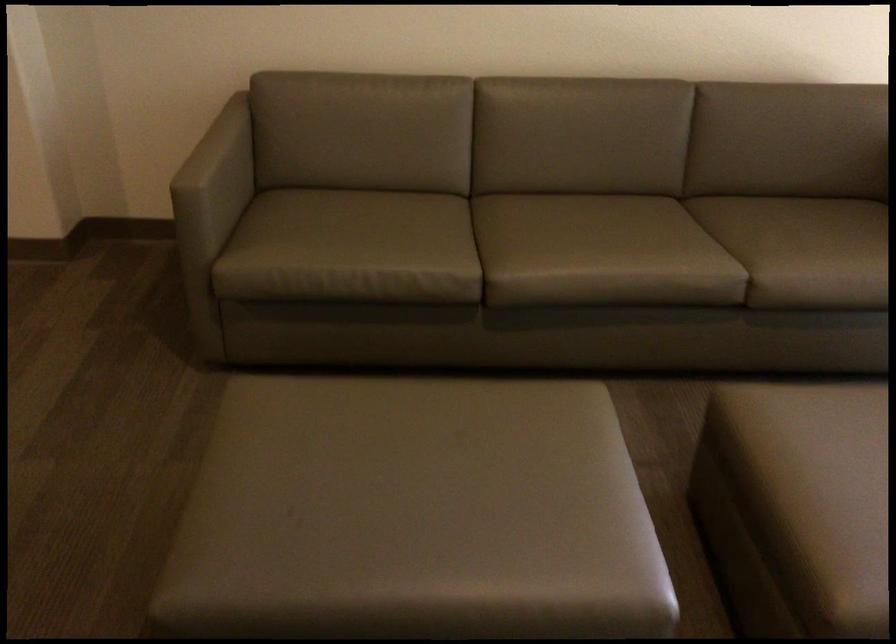
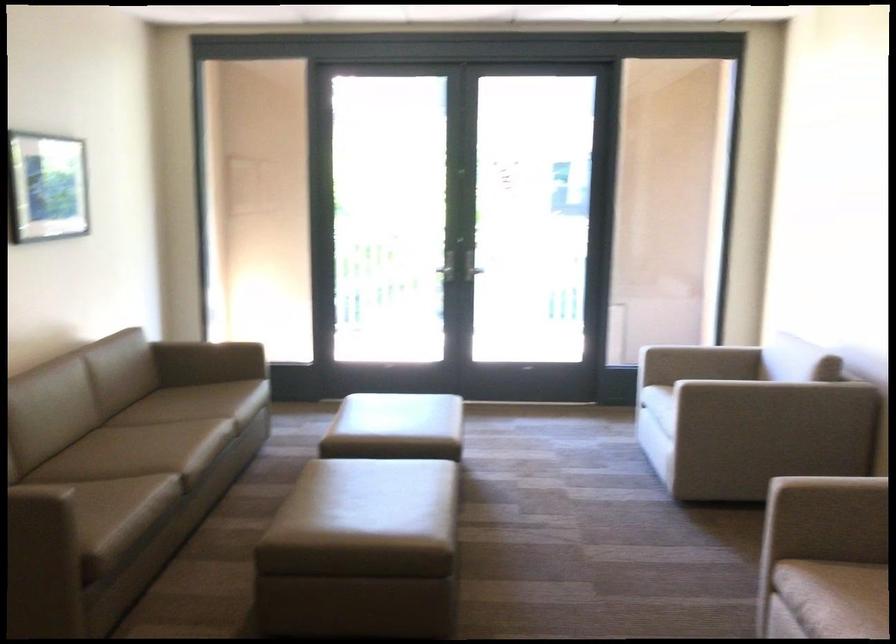
In the second image, find the point that corresponds to the point at 319,506 in the first image.

(367, 521)